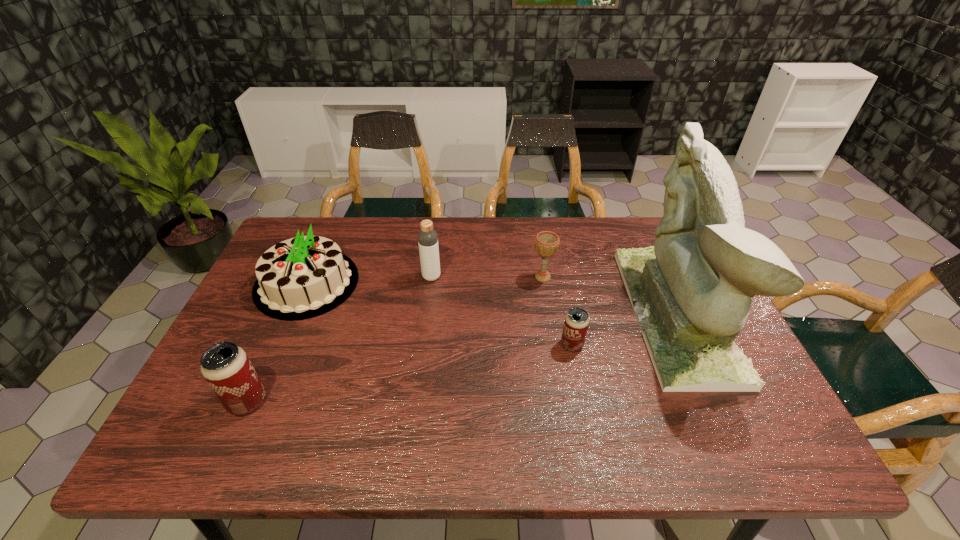
At what (x,y) coordinates should I click in order to perform the action: click on empty space that is in between the chalice and the third object from left to right. Please return your answer as a coordinate pair (x, y). Image resolution: width=960 pixels, height=540 pixels. Looking at the image, I should click on (487, 277).

At what (x,y) coordinates should I click in order to perform the action: click on vacant region between the nearer beer can and the farther beer can. Please return your answer as a coordinate pair (x, y). Looking at the image, I should click on (410, 373).

Identify the location of object that is the second nearest to the nearer beer can. The width and height of the screenshot is (960, 540). (427, 237).

Image resolution: width=960 pixels, height=540 pixels. I want to click on object that stands as the third closest to the shortest object, so click(x=427, y=237).

At what (x,y) coordinates should I click in order to perform the action: click on vacant space that satisfies the following two spatial constraints: 1. on the base of the rightmost object; 2. on the front side of the shorter beer can. Please return your answer as a coordinate pair (x, y). This screenshot has width=960, height=540. Looking at the image, I should click on (690, 345).

The image size is (960, 540). Find the location of `free space that satisfies the following two spatial constraints: 1. on the back side of the birthday cake; 2. on the right side of the chalice`. free space that satisfies the following two spatial constraints: 1. on the back side of the birthday cake; 2. on the right side of the chalice is located at coordinates (310, 277).

You are a GUI agent. You are given a task and a screenshot of the screen. Output one action in this format:
    pyautogui.click(x=<x>, y=<y>)
    Task: Click on the vacant area that satisfies the following two spatial constraints: 1. on the back side of the fourth object from right to left; 2. on the left side of the nearer beer can
    
    Given the screenshot: What is the action you would take?
    pyautogui.click(x=302, y=277)

This screenshot has width=960, height=540. I want to click on free space in the image that satisfies the following two spatial constraints: 1. on the front side of the fourth object from right to left; 2. on the left side of the farther beer can, so click(423, 345).